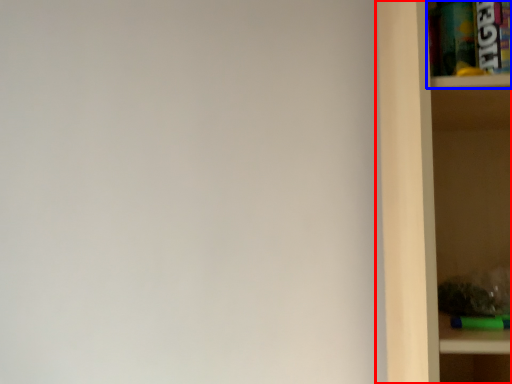
Question: Which object appears closest to the camera in this image, shelf (highlighted by a red box) or cabinet (highlighted by a blue box)?

Choices:
 (A) shelf
 (B) cabinet

Answer: (A)